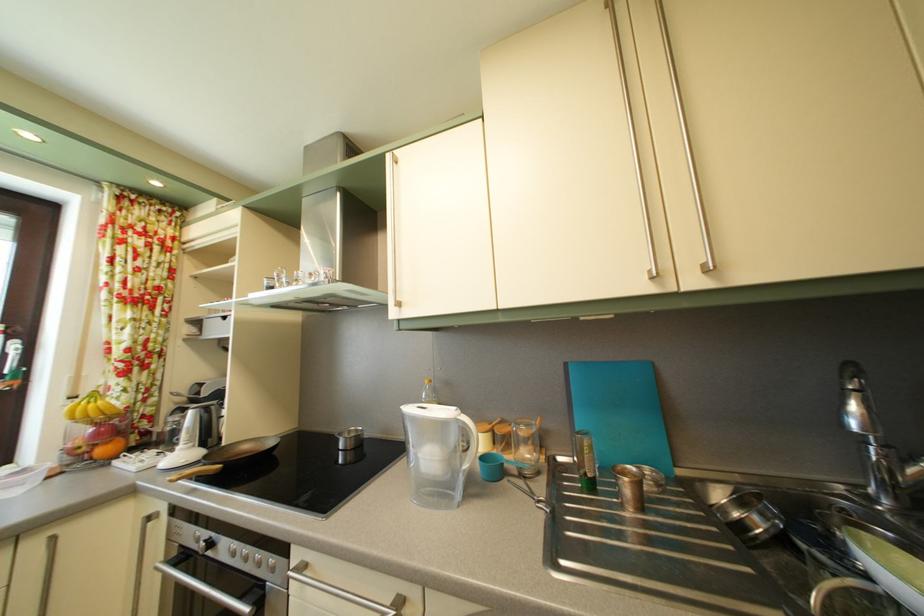
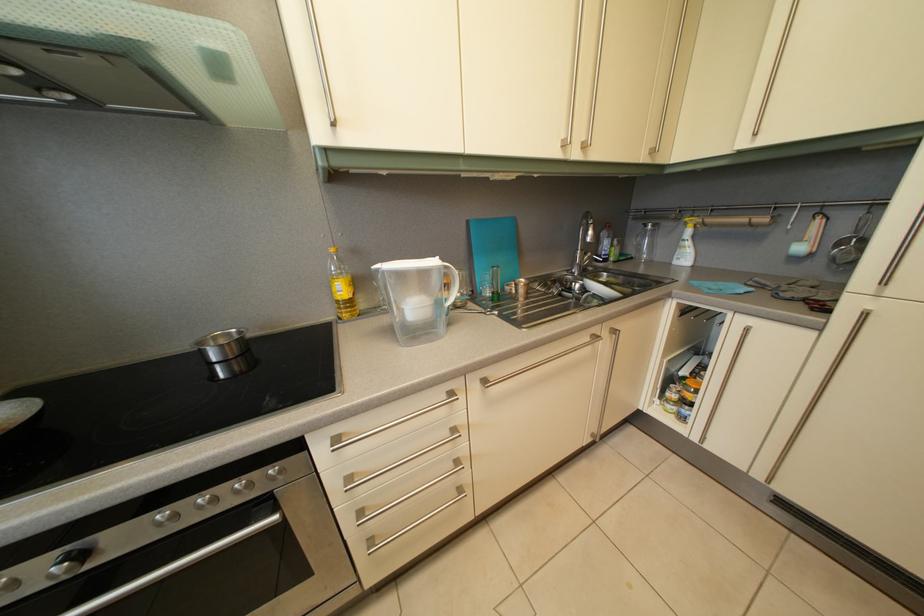
In the second image, find the point that corresponds to pixel 219 552 in the first image.

(92, 562)